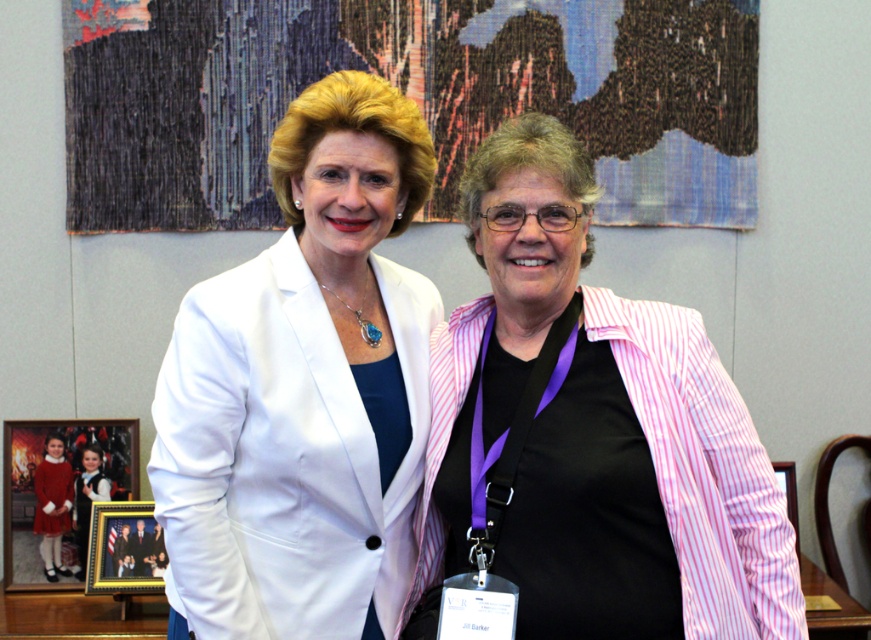
Question: Which point is closer to the camera?

Choices:
 (A) white matte blazer at center
 (B) gold-framed picture at lower left

Answer: (A)

Question: Is white matte blazer at center above wooden picture frame at right?

Choices:
 (A) yes
 (B) no

Answer: (A)

Question: Is pink striped blazer at center positioned in front of gold-framed picture at lower left?

Choices:
 (A) no
 (B) yes

Answer: (B)

Question: Among these points, which one is farthest from the camera?

Choices:
 (A) (782, 472)
 (B) (527, 147)
 (C) (66, 490)
 (D) (126, 532)

Answer: (A)

Question: Can you confirm if white matte blazer at center is positioned above wooden picture frame at right?

Choices:
 (A) no
 (B) yes

Answer: (B)

Question: Among these points, which one is nearest to the camera?

Choices:
 (A) (295, 394)
 (B) (75, 428)
 (C) (127, 512)

Answer: (A)